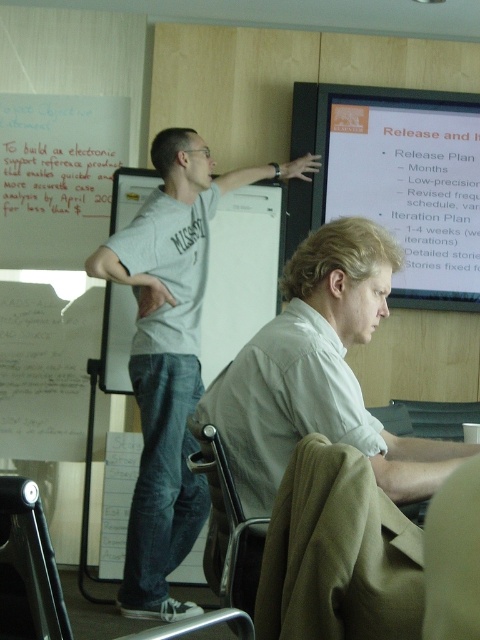
You are organizing a presentation and need to decide which item to move first. Based on their sizes, should you move the gray cotton shirt at upper center or the white paper at upper left first?

The gray cotton shirt at upper center is wider than the white paper at upper left, so you should move the gray cotton shirt at upper center first because it takes up more space.